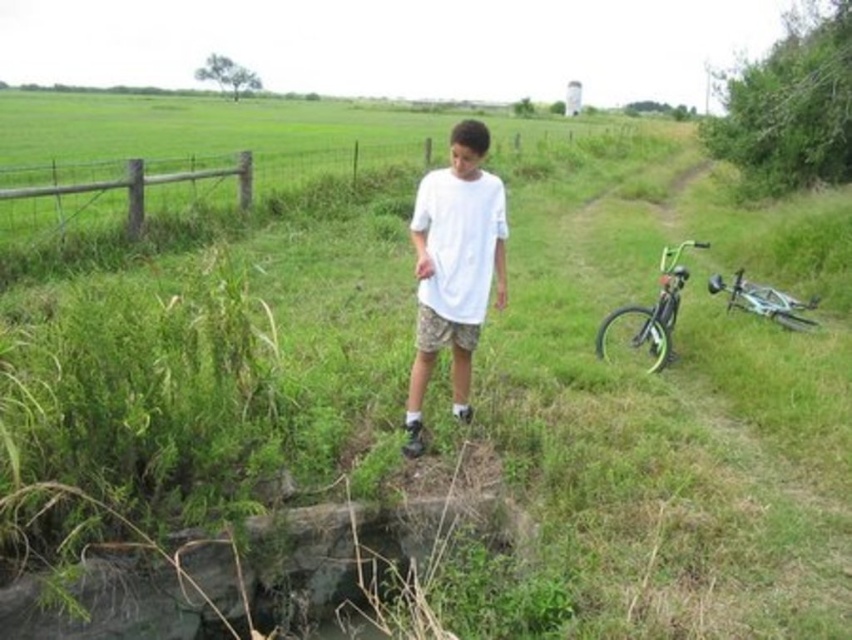
Question: Estimate the real-world distances between objects in this image. Which object is farther from the wooden fence at left?

Choices:
 (A) rocky concrete at lower left
 (B) white matte shirt at center
 (C) green matte bicycle at right
 (D) camouflage fabric shorts at center

Answer: (B)

Question: Which point is farther to the camera?

Choices:
 (A) wooden fence at left
 (B) camouflage fabric shorts at center
 (C) green matte bicycle at right

Answer: (A)

Question: Does wooden fence at left have a greater width compared to green matte bicycle at right?

Choices:
 (A) yes
 (B) no

Answer: (A)

Question: Which point is farther from the camera taking this photo?

Choices:
 (A) (x=776, y=310)
 (B) (x=450, y=326)

Answer: (A)

Question: Is white matte shirt at center to the right of green matte bicycle at right from the viewer's perspective?

Choices:
 (A) yes
 (B) no

Answer: (B)

Question: Can you confirm if white matte shirt at center is positioned to the right of camouflage fabric shorts at center?

Choices:
 (A) yes
 (B) no

Answer: (A)